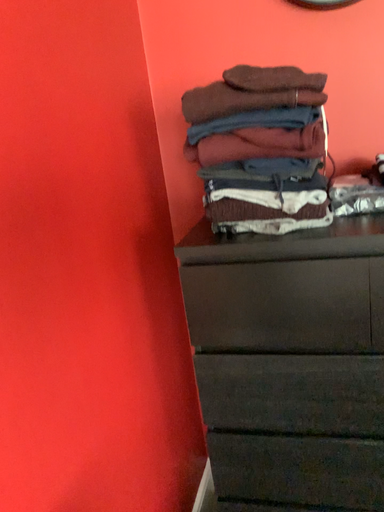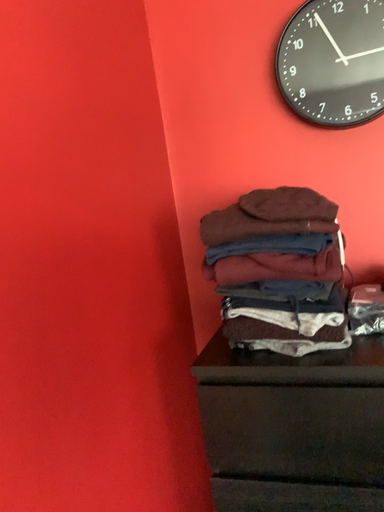
Question: How did the camera likely rotate when shooting the video?

Choices:
 (A) rotated downward
 (B) rotated upward

Answer: (B)